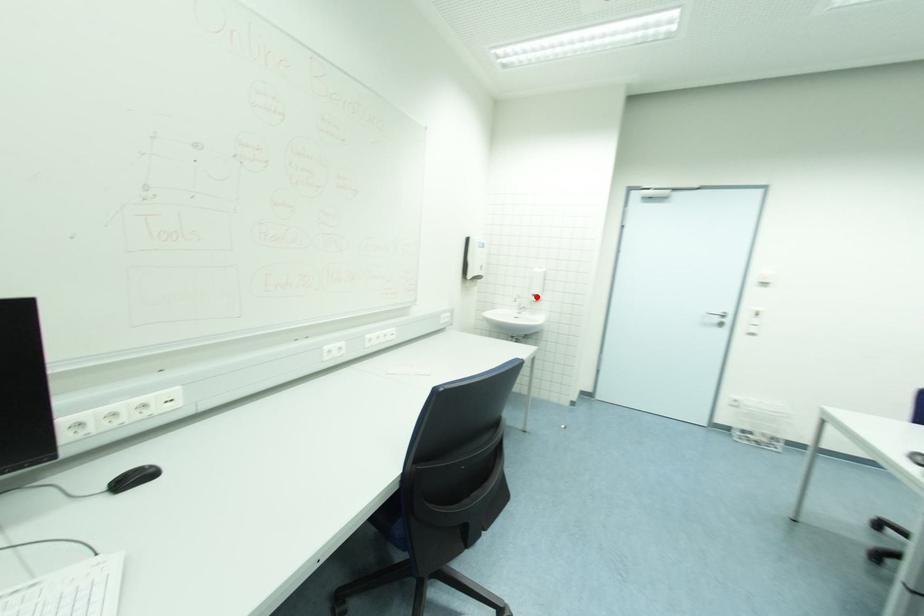
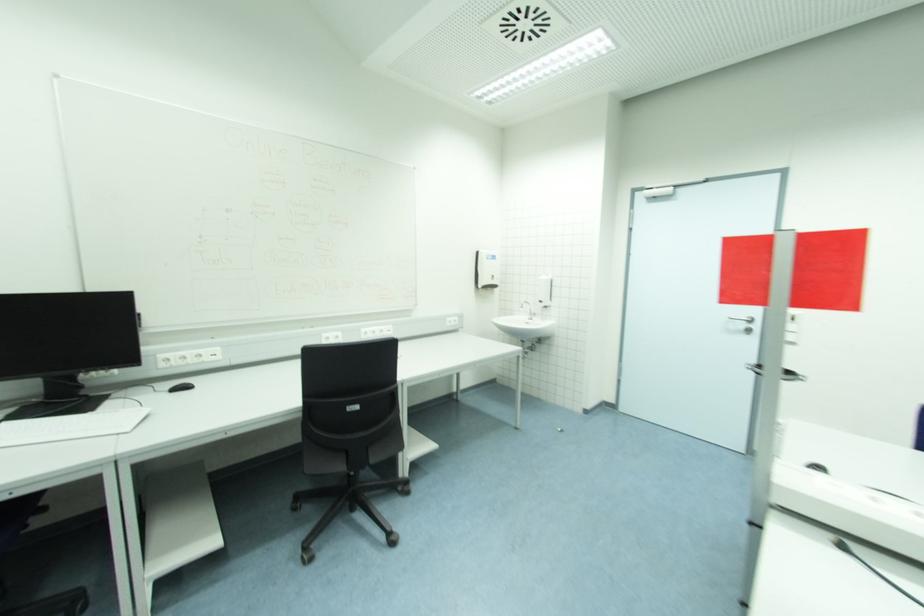
Find the pixel in the second image that matches the highlighted location in the first image.

(543, 302)